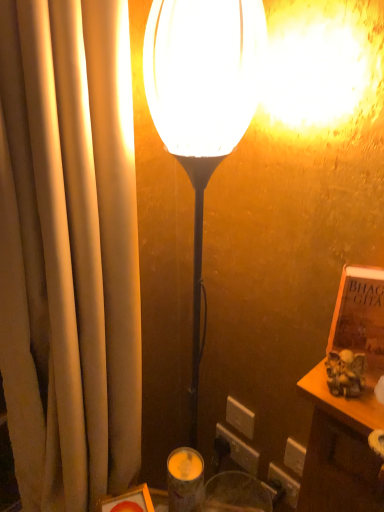
Question: Considering the positions of white plastic electric outlet at lower center, the first electric outlet in the top-to-bottom sequence, and beige fabric curtain at left in the image, is white plastic electric outlet at lower center, the first electric outlet in the top-to-bottom sequence, bigger or smaller than beige fabric curtain at left?

Choices:
 (A) small
 (B) big

Answer: (A)

Question: From the image's perspective, is white plastic electric outlet at lower center, the first electric outlet in the top-to-bottom sequence, above or below beige fabric curtain at left?

Choices:
 (A) above
 (B) below

Answer: (B)

Question: Estimate the real-world distances between objects in this image. Which object is farther from the beige fabric curtain at left?

Choices:
 (A) white plastic electric outlet at lower center, the first electric outlet in the top-to-bottom sequence
 (B) matte glass candle holder at lower center
 (C) white plastic electric outlet at lower center, acting as the first electric outlet starting from the bottom
 (D) brown leather book at right
 (E) matte white lamp at center

Answer: (C)

Question: Which object is the farthest from the white plastic electric outlet at lower center, the first electric outlet in the top-to-bottom sequence?

Choices:
 (A) brown leather book at right
 (B) matte white lamp at center
 (C) white plastic electric outlet at lower center, which is counted as the 2th electric outlet, starting from the top
 (D) matte glass candle holder at lower center
 (E) beige fabric curtain at left

Answer: (B)